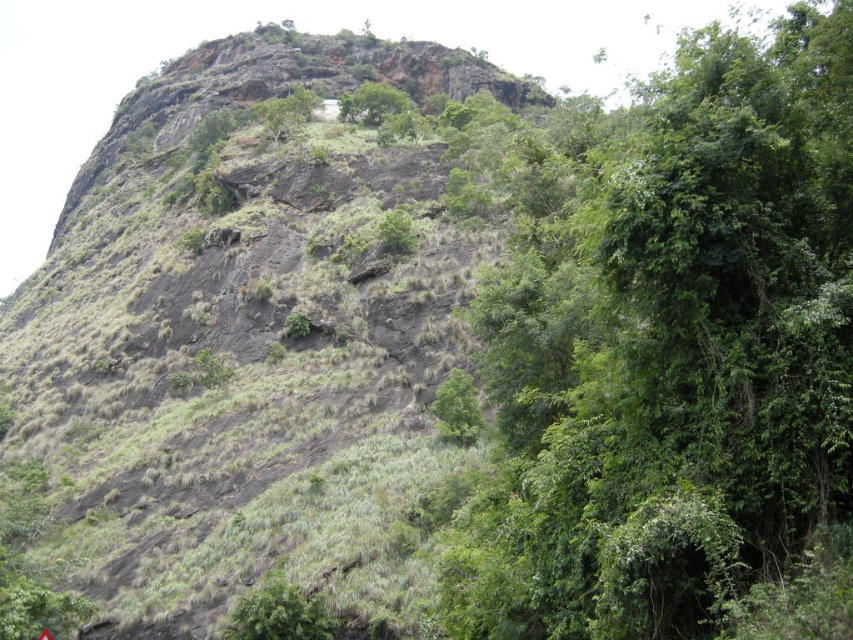
You are a hiker planning to traverse the rugged, rocky hillside shown in the image. You notice a point marked at coordinates (242, 346). Based on the scene description, what terrain feature does this point most likely represent?

The point at (242, 346) most likely represents a rugged rock mountain at upper left as indicated in the scene description.

You are a hiker standing at point (276, 620) and want to reach point (335, 442). Based on the terrain described, will you have to climb uphill or downhill to get there?

Since point (335, 442) is behind point (276, 620), you will have to climb uphill to reach it.

You are a hiker trying to navigate through the rocky hillside. You see a green leafy tree at upper right and a green leafy tree at lower center. Which tree is closer to you?

The green leafy tree at upper right is closer to you because it is in front of the green leafy tree at lower center.